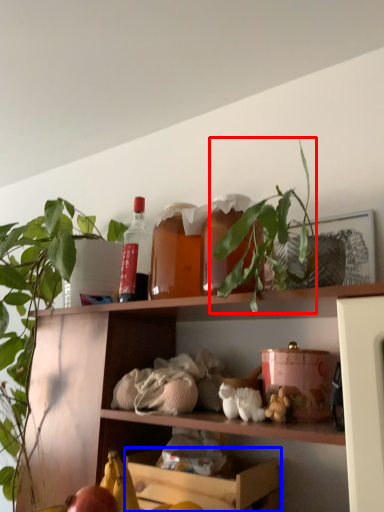
Question: Which of the following is the closest to the observer, plant (highlighted by a red box) or shelf (highlighted by a blue box)?

Choices:
 (A) plant
 (B) shelf

Answer: (A)